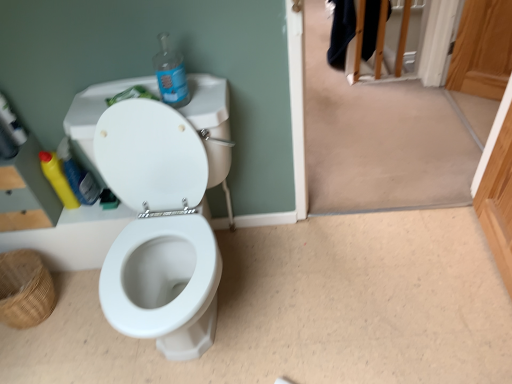
Where is `brown woven basket at lower left`? brown woven basket at lower left is located at coordinates (25, 289).

Find the location of a particular element. The width and height of the screenshot is (512, 384). yellow plastic bottle at left, the second bottle positioned from the front is located at coordinates (78, 175).

What do you see at coordinates (78, 175) in the screenshot?
I see `yellow plastic bottle at left, the second bottle positioned from the front` at bounding box center [78, 175].

This screenshot has height=384, width=512. Identify the location of yellow plastic bottle at left, acting as the first bottle starting from the left. (57, 179).

This screenshot has width=512, height=384. Identify the location of white glossy toilet at center. (160, 208).

Consider the image. How different are the orientations of white glossy toilet at center and transparent plastic bottle at upper center, positioned as the first bottle in front-to-back order, in degrees?

They differ by 1.95 degrees in their facing directions.

From the image's perspective, which is below, white glossy toilet at center or transparent plastic bottle at upper center, arranged as the 1th bottle when viewed from the right?

white glossy toilet at center is shown below in the image.

From the picture: Is white glossy toilet at center far from transparent plastic bottle at upper center, arranged as the 1th bottle when viewed from the right?

No, white glossy toilet at center is not far from transparent plastic bottle at upper center, arranged as the 1th bottle when viewed from the right.

From a real-world perspective, who is located lower, white glossy toilet at center or transparent plastic bottle at upper center, which is the third bottle from left to right?

In real-world perspective, white glossy toilet at center is lower.

Is yellow plastic bottle at left, which ranks as the second bottle in right-to-left order, oriented towards yellow plastic bottle at left, marked as the first bottle in a back-to-front arrangement?

No, yellow plastic bottle at left, which ranks as the second bottle in right-to-left order, is not turned towards yellow plastic bottle at left, marked as the first bottle in a back-to-front arrangement.

From the picture: How much distance is there between yellow plastic bottle at left, the second bottle positioned from the front, and yellow plastic bottle at left, marked as the first bottle in a back-to-front arrangement?

5.16 centimeters.

What's the angular difference between yellow plastic bottle at left, acting as the second bottle starting from the left, and yellow plastic bottle at left, marked as the first bottle in a back-to-front arrangement,'s facing directions?

The angular difference between yellow plastic bottle at left, acting as the second bottle starting from the left, and yellow plastic bottle at left, marked as the first bottle in a back-to-front arrangement, is 0.00588 degrees.

Based on the photo, can you confirm if yellow plastic bottle at left, the second bottle in the back-to-front sequence, is positioned to the left of yellow plastic bottle at left, the third bottle from the front?

Incorrect, yellow plastic bottle at left, the second bottle in the back-to-front sequence, is not on the left side of yellow plastic bottle at left, the third bottle from the front.

Considering the relative positions of transparent plastic bottle at upper center, arranged as the 1th bottle when viewed from the right, and brown woven basket at lower left in the image provided, is transparent plastic bottle at upper center, arranged as the 1th bottle when viewed from the right, to the right of brown woven basket at lower left from the viewer's perspective?

Indeed, transparent plastic bottle at upper center, arranged as the 1th bottle when viewed from the right, is positioned on the right side of brown woven basket at lower left.

Is transparent plastic bottle at upper center, arranged as the 3th bottle when viewed from the back, looking in the opposite direction of brown woven basket at lower left?

No, transparent plastic bottle at upper center, arranged as the 3th bottle when viewed from the back, is not facing the opposite direction of brown woven basket at lower left.

Is there a large distance between transparent plastic bottle at upper center, arranged as the 3th bottle when viewed from the back, and brown woven basket at lower left?

No, there isn't a large distance between transparent plastic bottle at upper center, arranged as the 3th bottle when viewed from the back, and brown woven basket at lower left.

Is transparent plastic bottle at upper center, positioned as the first bottle in front-to-back order, outside of brown woven basket at lower left?

That's correct, transparent plastic bottle at upper center, positioned as the first bottle in front-to-back order, is outside of brown woven basket at lower left.

Is white glossy toilet at center shorter than yellow plastic bottle at left, acting as the second bottle starting from the left?

No, white glossy toilet at center is not shorter than yellow plastic bottle at left, acting as the second bottle starting from the left.

From a real-world perspective, is white glossy toilet at center positioned over yellow plastic bottle at left, which ranks as the second bottle in right-to-left order, based on gravity?

No, from a real-world perspective, white glossy toilet at center is not over yellow plastic bottle at left, which ranks as the second bottle in right-to-left order

Consider the image. Can you see white glossy toilet at center touching yellow plastic bottle at left, the second bottle positioned from the front?

No, white glossy toilet at center is not beside yellow plastic bottle at left, the second bottle positioned from the front.

In terms of size, does white glossy toilet at center appear bigger or smaller than yellow plastic bottle at left, the second bottle positioned from the front?

Considering their sizes, white glossy toilet at center takes up more space than yellow plastic bottle at left, the second bottle positioned from the front.

From their relative heights in the image, would you say yellow plastic bottle at left, which is the third bottle in right-to-left order, is taller or shorter than brown woven basket at lower left?

yellow plastic bottle at left, which is the third bottle in right-to-left order, is taller than brown woven basket at lower left.

Is the depth of yellow plastic bottle at left, acting as the first bottle starting from the left, less than that of brown woven basket at lower left?

No, it is not.

The width and height of the screenshot is (512, 384). Identify the location of basket below the yellow plastic bottle at left, which is the third bottle in right-to-left order (from the image's perspective). coord(25,289).

Is yellow plastic bottle at left, marked as the first bottle in a back-to-front arrangement, far from white glossy toilet at center?

No, yellow plastic bottle at left, marked as the first bottle in a back-to-front arrangement, is in close proximity to white glossy toilet at center.

Which is more to the right, yellow plastic bottle at left, the third bottle from the front, or white glossy toilet at center?

white glossy toilet at center is more to the right.

Considering their positions, is yellow plastic bottle at left, marked as the first bottle in a back-to-front arrangement, located in front of or behind white glossy toilet at center?

yellow plastic bottle at left, marked as the first bottle in a back-to-front arrangement, is behind white glossy toilet at center.

Does transparent plastic bottle at upper center, arranged as the 1th bottle when viewed from the right, touch yellow plastic bottle at left, which is the third bottle in right-to-left order?

No.

From the image's perspective, is transparent plastic bottle at upper center, arranged as the 3th bottle when viewed from the back, beneath yellow plastic bottle at left, marked as the first bottle in a back-to-front arrangement?

No.

From a real-world perspective, is transparent plastic bottle at upper center, arranged as the 3th bottle when viewed from the back, physically below yellow plastic bottle at left, the third bottle from the front?

Actually, transparent plastic bottle at upper center, arranged as the 3th bottle when viewed from the back, is physically above yellow plastic bottle at left, the third bottle from the front, in the real world.

This screenshot has height=384, width=512. Identify the location of the 3rd bottle located above the white glossy toilet at center (from a real-world perspective). (x=170, y=74).

Where is `bottle behind the yellow plastic bottle at left, the second bottle in the back-to-front sequence`? bottle behind the yellow plastic bottle at left, the second bottle in the back-to-front sequence is located at coordinates (57, 179).

Which object lies nearer to the anchor point white glossy toilet at center, transparent plastic bottle at upper center, which is the third bottle from left to right, or yellow plastic bottle at left, marked as the first bottle in a back-to-front arrangement?

The object closer to white glossy toilet at center is transparent plastic bottle at upper center, which is the third bottle from left to right.

When comparing their distances from yellow plastic bottle at left, the second bottle in the back-to-front sequence, does white glossy toilet at center or transparent plastic bottle at upper center, arranged as the 1th bottle when viewed from the right, seem further?

The object further to yellow plastic bottle at left, the second bottle in the back-to-front sequence, is transparent plastic bottle at upper center, arranged as the 1th bottle when viewed from the right.

From the image, which object appears to be farther from transparent plastic bottle at upper center, positioned as the first bottle in front-to-back order, yellow plastic bottle at left, marked as the first bottle in a back-to-front arrangement, or white glossy toilet at center?

yellow plastic bottle at left, marked as the first bottle in a back-to-front arrangement, is positioned further to the anchor transparent plastic bottle at upper center, positioned as the first bottle in front-to-back order.

Based on their spatial positions, is yellow plastic bottle at left, acting as the first bottle starting from the left, or transparent plastic bottle at upper center, which is the third bottle from left to right, further from brown woven basket at lower left?

transparent plastic bottle at upper center, which is the third bottle from left to right, is further to brown woven basket at lower left.

Considering their positions, is transparent plastic bottle at upper center, arranged as the 1th bottle when viewed from the right, positioned further to yellow plastic bottle at left, which is the third bottle in right-to-left order, than white glossy toilet at center?

Based on the image, transparent plastic bottle at upper center, arranged as the 1th bottle when viewed from the right, appears to be further to yellow plastic bottle at left, which is the third bottle in right-to-left order.

Which object lies nearer to the anchor point yellow plastic bottle at left, which ranks as the second bottle in right-to-left order, brown woven basket at lower left or white glossy toilet at center?

brown woven basket at lower left.

Considering their positions, is yellow plastic bottle at left, the second bottle positioned from the front, positioned further to brown woven basket at lower left than yellow plastic bottle at left, marked as the first bottle in a back-to-front arrangement?

yellow plastic bottle at left, the second bottle positioned from the front, is further to brown woven basket at lower left.

Estimate the real-world distances between objects in this image. Which object is closer to white glossy toilet at center, brown woven basket at lower left or yellow plastic bottle at left, acting as the second bottle starting from the left?

Based on the image, yellow plastic bottle at left, acting as the second bottle starting from the left, appears to be nearer to white glossy toilet at center.

Find the location of `sink located between brown woven basket at lower left and transparent plastic bottle at upper center, arranged as the 1th bottle when viewed from the right, in the left-right direction`. sink located between brown woven basket at lower left and transparent plastic bottle at upper center, arranged as the 1th bottle when viewed from the right, in the left-right direction is located at coordinates (160, 208).

Locate an element on the screen. This screenshot has height=384, width=512. bottle located between yellow plastic bottle at left, acting as the first bottle starting from the left, and transparent plastic bottle at upper center, arranged as the 3th bottle when viewed from the back, in the left-right direction is located at coordinates (78, 175).

Image resolution: width=512 pixels, height=384 pixels. What are the coordinates of `bottle between white glossy toilet at center and yellow plastic bottle at left, the second bottle in the back-to-front sequence, along the z-axis` in the screenshot? It's located at (170, 74).

Identify the location of bottle between yellow plastic bottle at left, acting as the second bottle starting from the left, and brown woven basket at lower left, in the vertical direction. The image size is (512, 384). (57, 179).